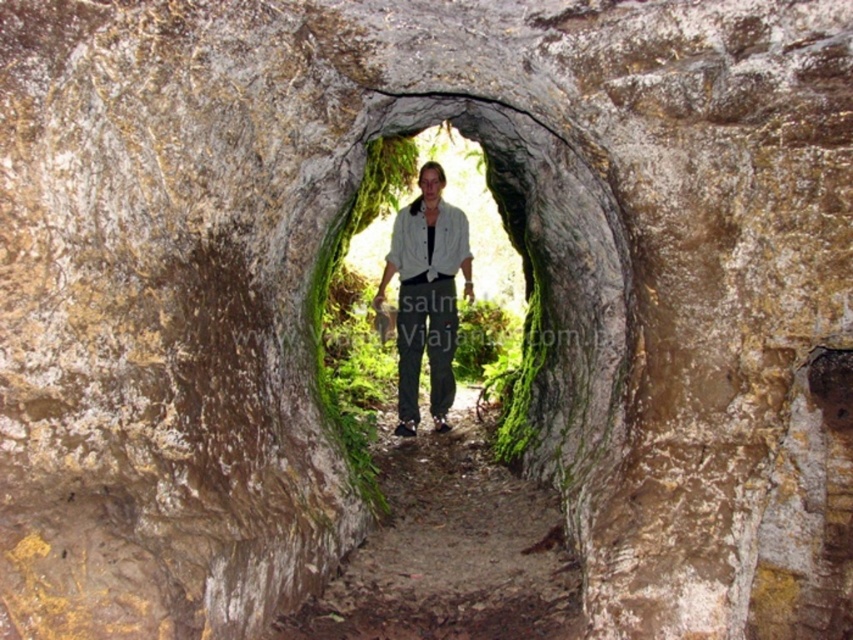
In the scene shown: You are a photographer standing in front of the stone archway. You want to capture a photo where the green mossy rock at center and the light gray shirt at center are both visible. Based on their positions, which object will appear lower in the photo?

The green mossy rock at center is located below the light gray shirt at center, so it will appear lower in the photo.

You are a photographer trying to capture the light gray shirt at center and the green mossy rock at center in the same frame. Based on their positions, which object would appear closer to the camera in your photo?

The green mossy rock at center is in front of the light gray shirt at center, so it would appear closer to the camera in the photo.